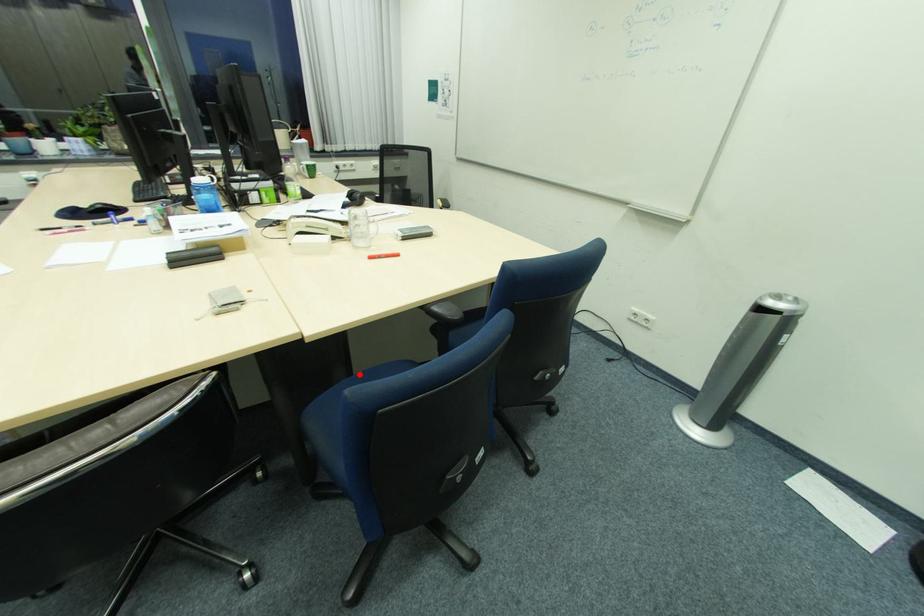
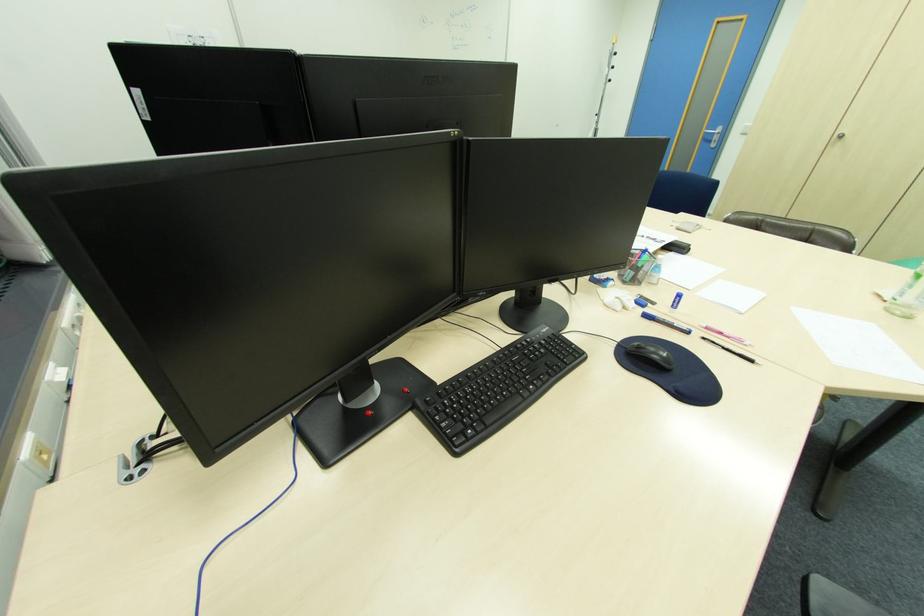
Question: I am providing you with two images of the same scene from different viewpoints. A red point is marked on the first image. At the location where the point appears in image 1, is it still visible in image 2?

Choices:
 (A) Yes
 (B) No

Answer: (B)